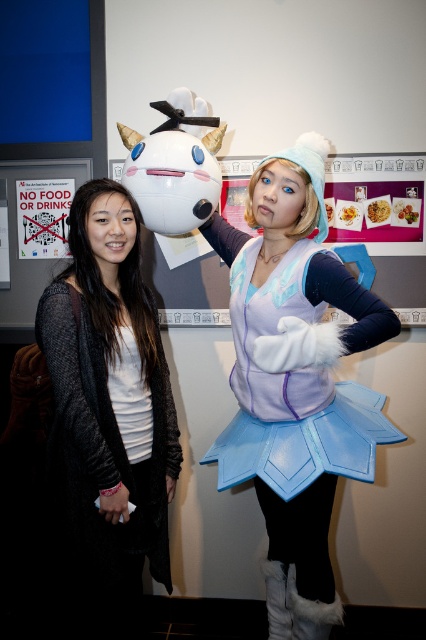
In the scene shown: Measure the distance between black knit cardigan at left and paper posters at center.

3.74 feet

Does black knit cardigan at left appear over paper posters at center?

No.

The width and height of the screenshot is (426, 640). In order to click on black knit cardigan at left in this screenshot , I will do `click(108, 416)`.

Identify the location of black knit cardigan at left. (108, 416).

How far apart are black knit cardigan at left and matte purple vest at center?

black knit cardigan at left and matte purple vest at center are 17.42 inches apart.

Between point (72, 248) and point (328, 518), which one is positioned in front?

Point (72, 248) is in front.

I want to click on black knit cardigan at left, so click(x=108, y=416).

Which is above, matte purple vest at center or paper posters at center?

paper posters at center is higher up.

Which of these two, matte purple vest at center or paper posters at center, stands shorter?

Standing shorter between the two is paper posters at center.

Where is `matte purple vest at center`? The image size is (426, 640). matte purple vest at center is located at coordinates (290, 291).